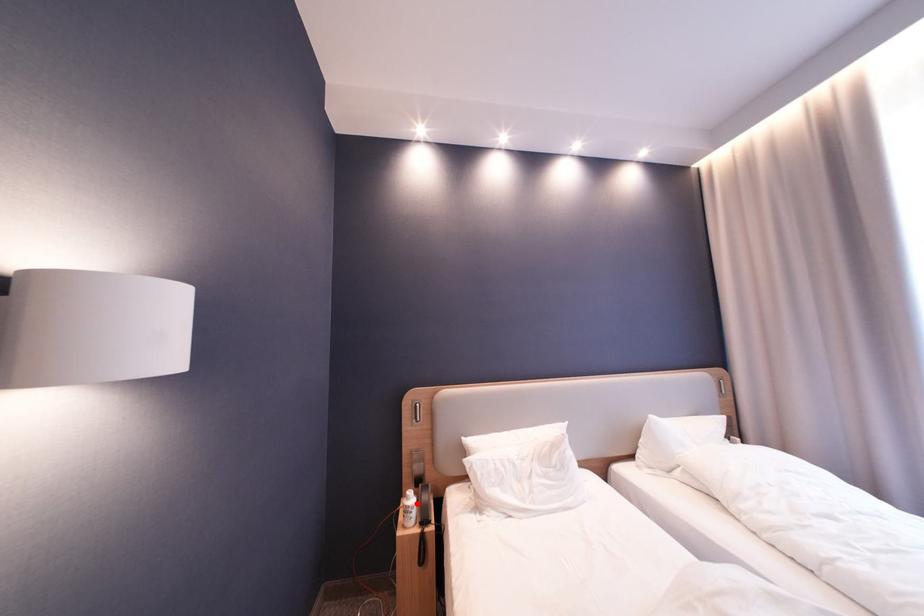
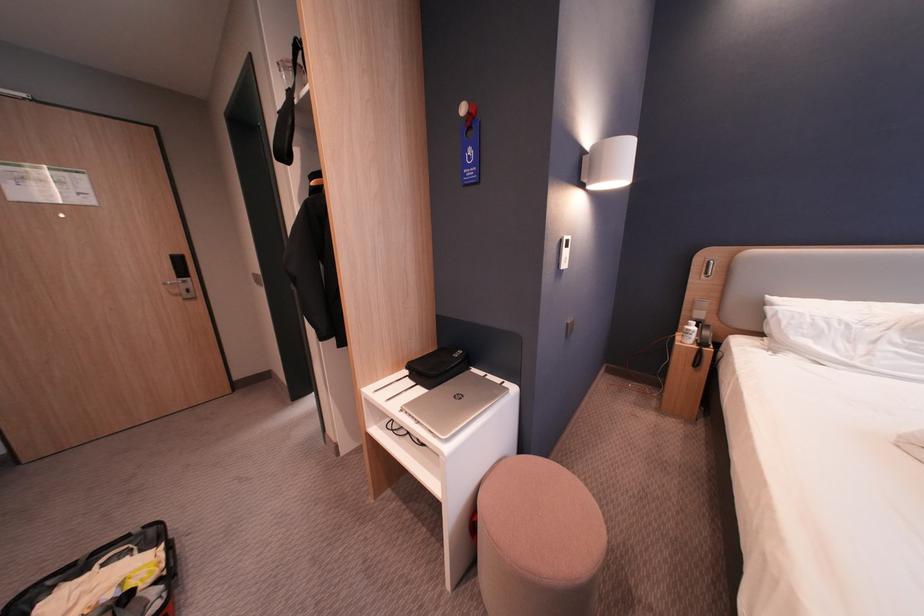
In the second image, find the point that corresponds to the highlighted location in the first image.

(698, 328)